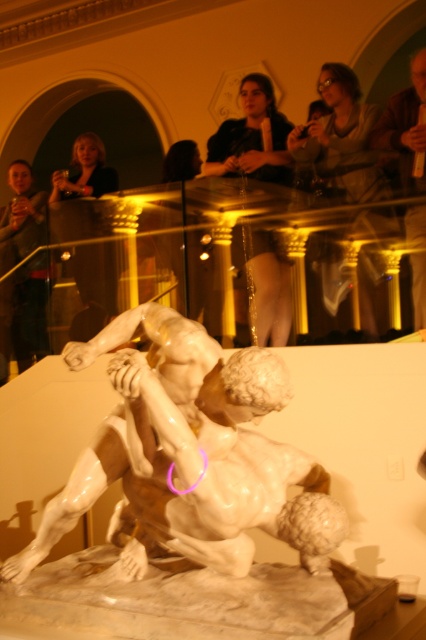
You are an art conservator assessing the space between two marble artworks in a museum. The white glossy marble sculpture at center and the white marble statue at center are both displayed on the same pedestal. Based on the provided information, which of the two is wider?

The white glossy marble sculpture at center is wider than the white marble statue at center according to the description provided.

You are a photographer standing in front of the white marble statue at center. You want to take a photo of it from exactly 7 meters away. Is your current position suitable for this?

The white marble statue at center is 6.91 meters from camera, so your current position is suitable because you are already at approximately 7 meters away.